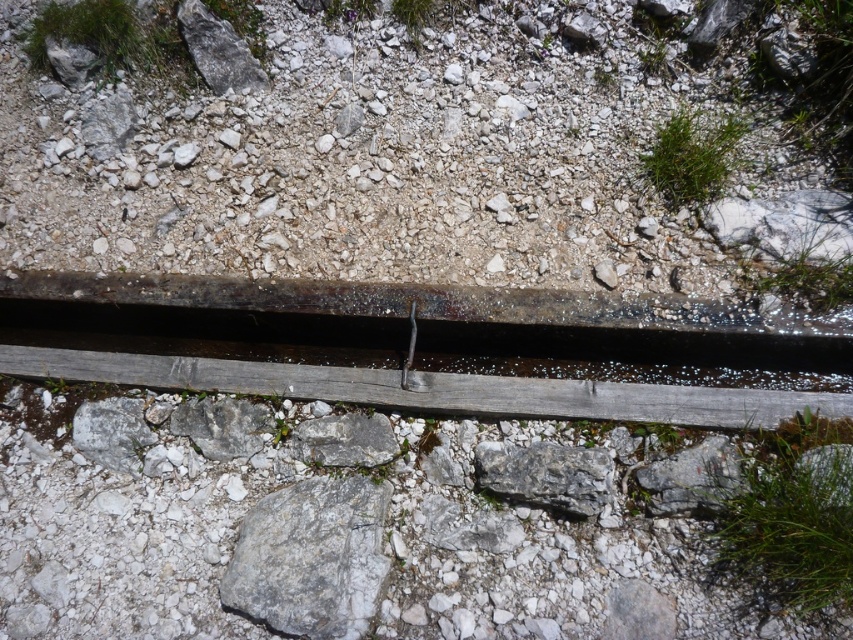
Who is positioned more to the right, rusty metal rail at center or gray/rough gravel at center?

From the viewer's perspective, rusty metal rail at center appears more on the right side.

Does rusty metal rail at center come behind gray/rough gravel at center?

Yes.

Locate an element on the screen. The height and width of the screenshot is (640, 853). rusty metal rail at center is located at coordinates (361, 168).

The image size is (853, 640). What are the coordinates of `rusty metal rail at center` in the screenshot? It's located at (361, 168).

Is gray/rough gravel at center bigger than rusty metal pipe at center?

Yes, gray/rough gravel at center is bigger than rusty metal pipe at center.

Between gray/rough gravel at center and rusty metal pipe at center, which one is positioned lower?

gray/rough gravel at center is lower down.

Who is more distant from viewer, (170, 600) or (415, 300)?

The point (415, 300) is more distant.

Find the location of a particular element. The image size is (853, 640). gray/rough gravel at center is located at coordinates (318, 531).

Between point (271, 600) and point (378, 506), which one is positioned behind?

The point (378, 506) is more distant.

Is point (91, 452) behind point (350, 636)?

Yes, it is.

Image resolution: width=853 pixels, height=640 pixels. I want to click on gray/rough gravel at center, so click(x=318, y=531).